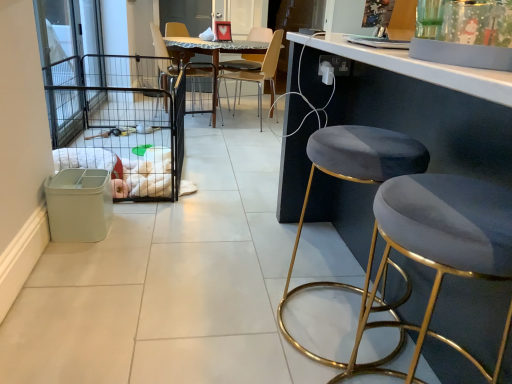
Identify the location of free location in front of metallic brown chair at upper center, which ranks as the first chair in left-to-right order. [194, 130].